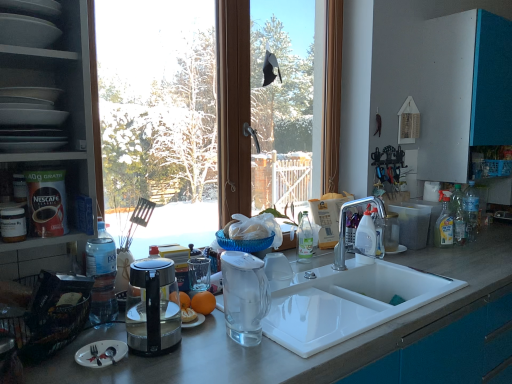
Find the location of a particular element. The image size is (512, 384). free point above white ceramic sink at lower center (from a real-world perspective) is located at coordinates [311, 299].